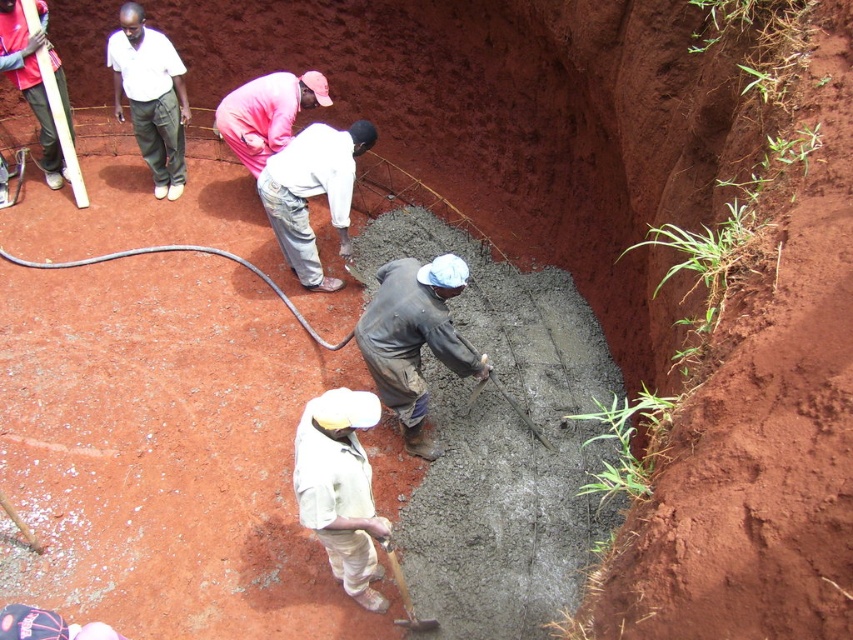
Question: Is the position of white cotton shirt at center less distant than that of pink matte shirt at center?

Choices:
 (A) yes
 (B) no

Answer: (A)

Question: Which object is farther from the camera taking this photo?

Choices:
 (A) white cotton shirt at upper left
 (B) white cotton shirt at center
 (C) dark gray uniform at center
 (D) wooden handle shovel at lower center

Answer: (A)

Question: Which of the following is the closest to the observer?

Choices:
 (A) white matte shirt at center
 (B) white cotton shirt at upper left
 (C) wooden handle shovel at lower center
 (D) dark gray uniform at center

Answer: (A)

Question: Which object is the closest to the white matte shirt at center?

Choices:
 (A) pink matte shirt at center
 (B) dark gray uniform at center
 (C) white cotton shirt at upper left
 (D) wooden handle shovel at lower center

Answer: (D)

Question: Is dark gray uniform at center below white cotton shirt at upper left?

Choices:
 (A) yes
 (B) no

Answer: (A)

Question: Is white cotton shirt at center below pink matte shirt at center?

Choices:
 (A) yes
 (B) no

Answer: (A)